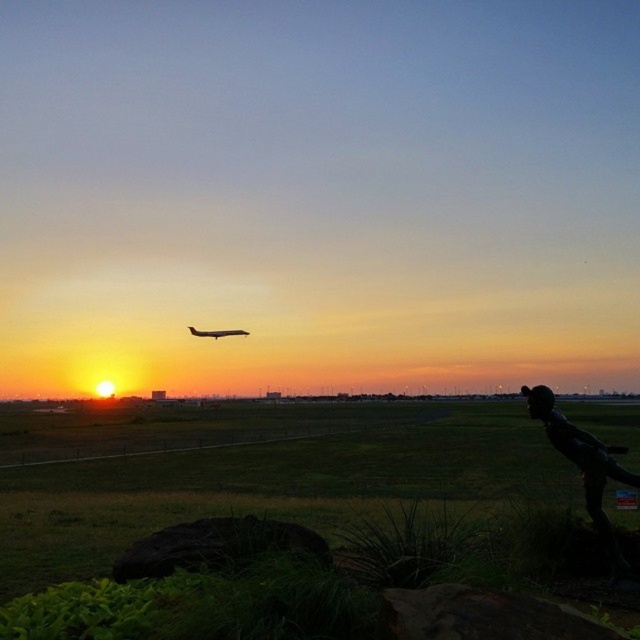
Is black matte statue at lower right thinner than metallic airplane at center?

Yes.

Is point (520, 392) in front of point (220, 337)?

Yes, it is.

Between point (608, 445) and point (228, 332), which one is positioned behind?

The point (228, 332) is more distant.

In order to click on black matte statue at lower right in this screenshot , I will do tap(580, 454).